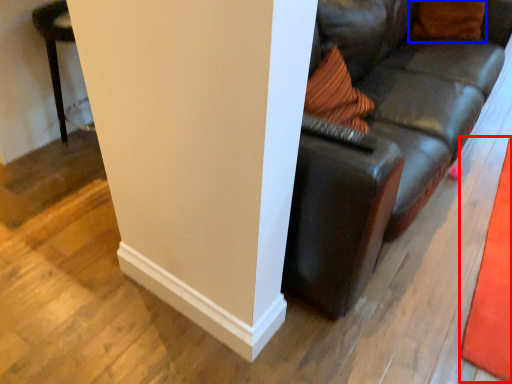
Question: Which of the following is the closest to the observer, mat (highlighted by a red box) or pillow (highlighted by a blue box)?

Choices:
 (A) mat
 (B) pillow

Answer: (A)